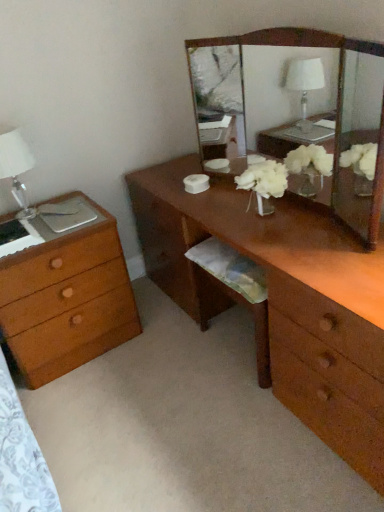
Locate an element on the screen. This screenshot has width=384, height=512. vacant space that is in between brown wooden desk at center and wooden chest of drawers at left is located at coordinates (173, 386).